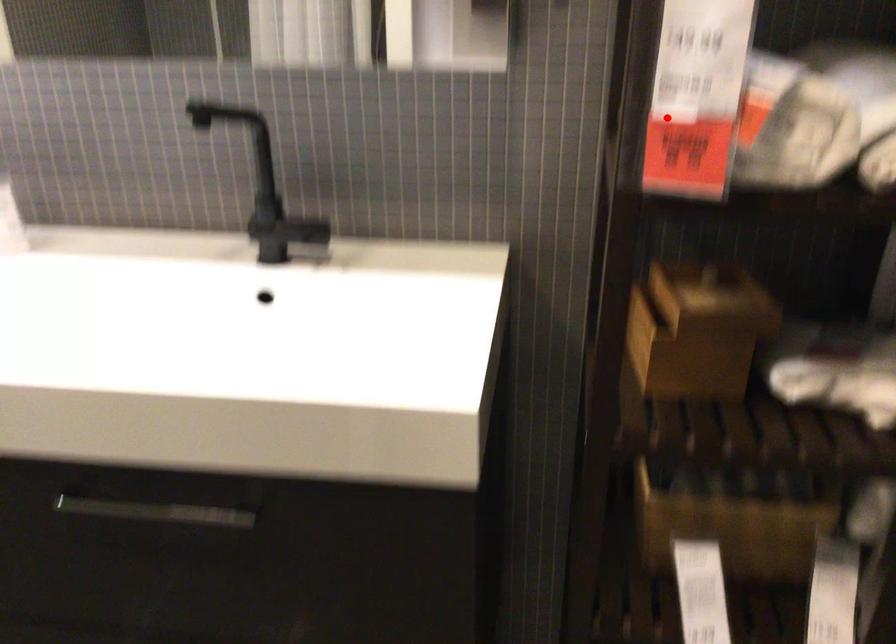
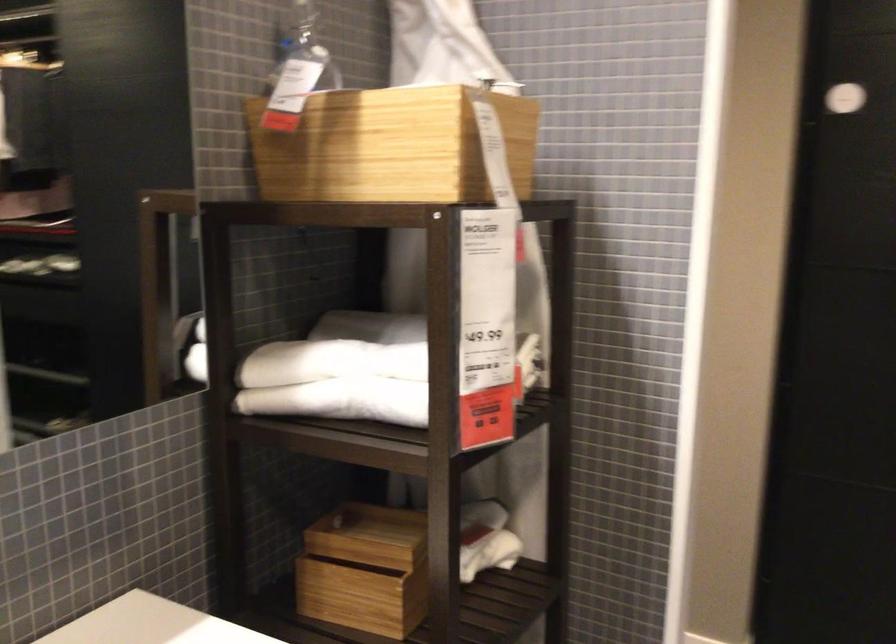
Locate, in the second image, the point that corresponds to the highlighted location in the first image.

(341, 401)